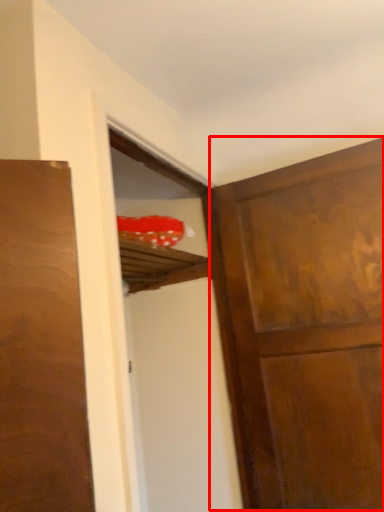
Question: From the image's perspective, what is the correct spatial relationship of door (annotated by the red box) in relation to screen door?

Choices:
 (A) above
 (B) below

Answer: (B)